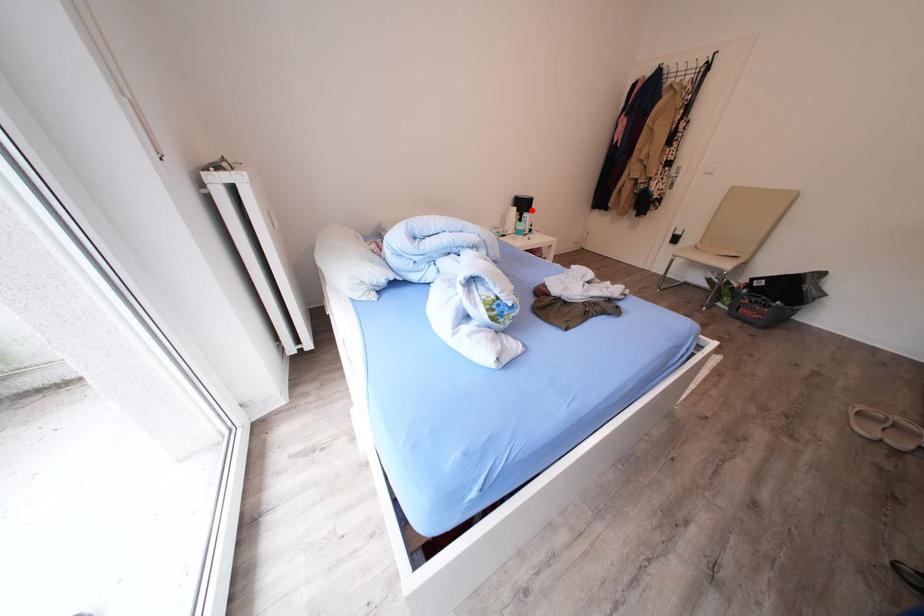
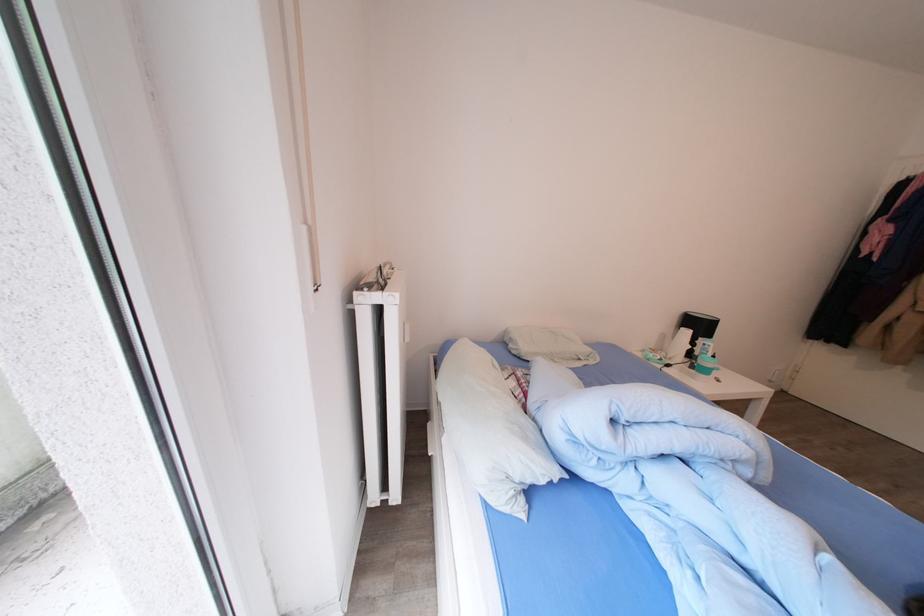
Question: I am providing you with two images of the same scene from different viewpoints. Image1 has a red point marked. In image2, the corresponding 3D location appears at what relative position? Reply with the corresponding letter.

Choices:
 (A) Closer
 (B) Farther

Answer: (B)